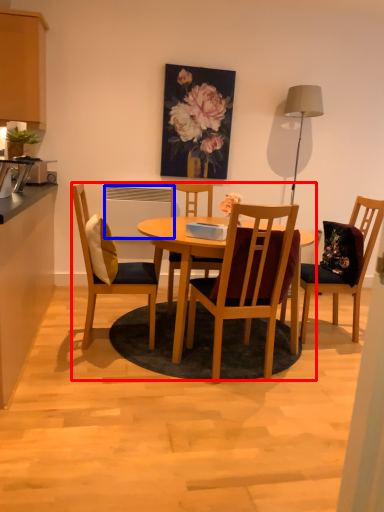
Question: Which object appears farthest to the camera in this image, kitchen & dining room table (highlighted by a red box) or appliance (highlighted by a blue box)?

Choices:
 (A) kitchen & dining room table
 (B) appliance

Answer: (B)